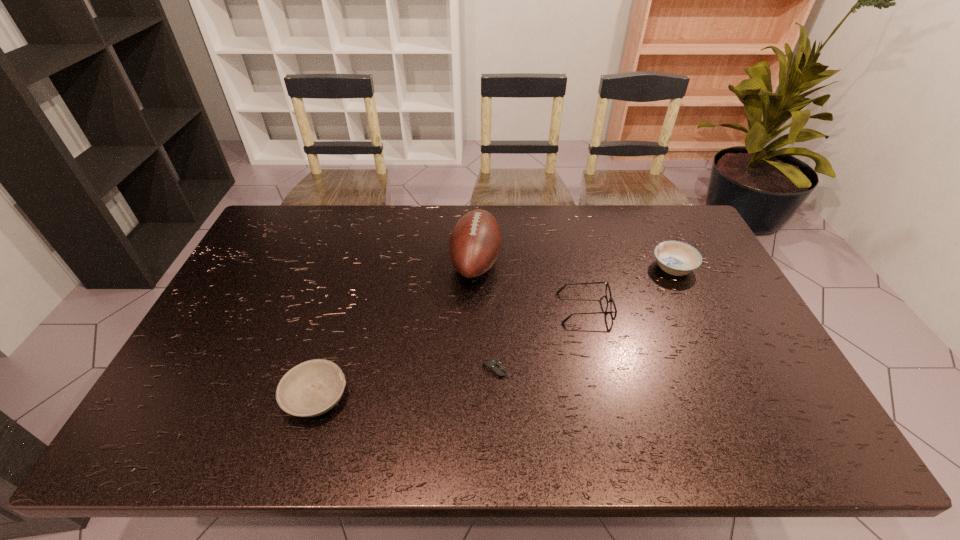
The height and width of the screenshot is (540, 960). I want to click on vacant space situated 0.260m with the lenses facing outward on the spectacles, so click(x=469, y=308).

Where is `vacant position located 0.360m with the lenses facing outward on the spectacles`? The image size is (960, 540). vacant position located 0.360m with the lenses facing outward on the spectacles is located at coordinates (435, 308).

Image resolution: width=960 pixels, height=540 pixels. I want to click on vacant space situated on the back of the nearer bowl, so click(x=338, y=325).

This screenshot has height=540, width=960. I want to click on free space located 0.110m on the left of the shortest object, so click(x=440, y=370).

Find the location of a particular element. This screenshot has width=960, height=540. object at the far edge is located at coordinates (475, 242).

Image resolution: width=960 pixels, height=540 pixels. In order to click on object that is positioned at the near edge in this screenshot , I will do `click(311, 388)`.

Where is `object that is at the right edge`? Image resolution: width=960 pixels, height=540 pixels. object that is at the right edge is located at coordinates (677, 258).

Image resolution: width=960 pixels, height=540 pixels. In the image, there is a desktop. Identify the location of vacant space at the far edge. (498, 211).

Where is `vacant space at the near edge of the desktop`? vacant space at the near edge of the desktop is located at coordinates (421, 436).

Find the location of `vacant space at the left edge of the desktop`. vacant space at the left edge of the desktop is located at coordinates 270,247.